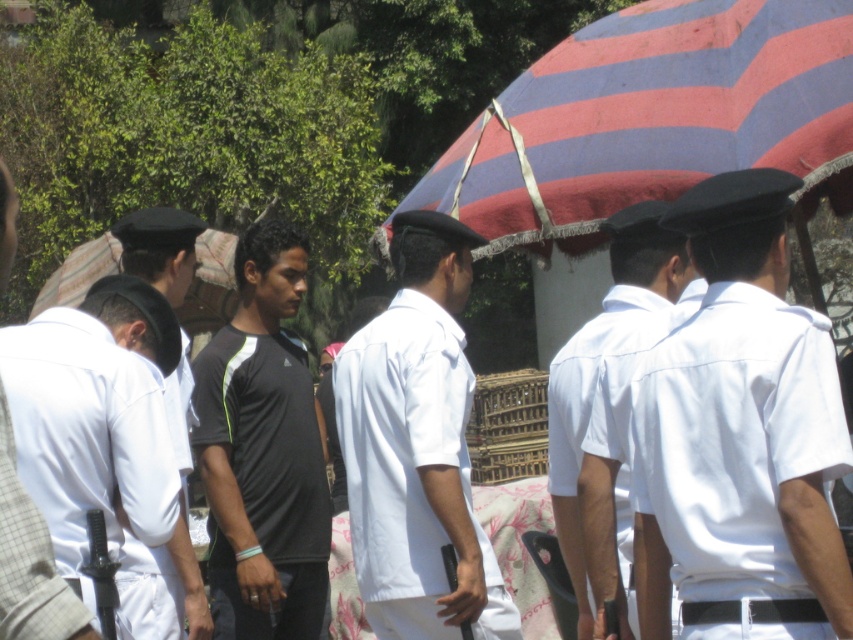
Question: Which point is farther to the camera?

Choices:
 (A) white cotton shirt at left
 (B) matte black shirt at center

Answer: (B)

Question: Which of the following is the farthest from the observer?

Choices:
 (A) (460, 493)
 (B) (612, 429)
 (C) (509, 141)
 (D) (200, 385)

Answer: (C)

Question: Is white matte uniform at left to the left of white cotton shirt at left from the viewer's perspective?

Choices:
 (A) yes
 (B) no

Answer: (A)

Question: Which of the following is the farthest from the observer?

Choices:
 (A) white matte uniform at left
 (B) black matte t-shirt at center
 (C) white smooth shirt at center
 (D) matte black shirt at center

Answer: (B)

Question: In this image, where is black matte t-shirt at center located relative to matte black shirt at center?

Choices:
 (A) right
 (B) left

Answer: (A)

Question: Does white matte uniform at left have a lesser width compared to white cotton shirt at left?

Choices:
 (A) yes
 (B) no

Answer: (B)